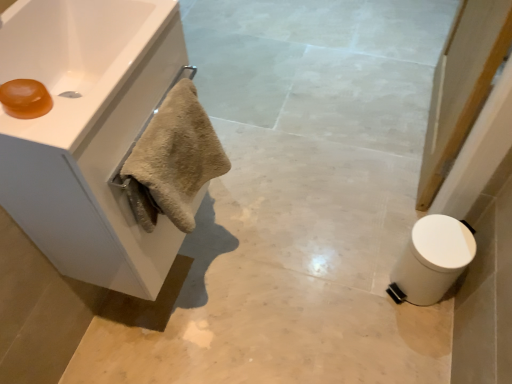
Question: Is white matte cabinet at upper left to the right of white matte trash can at lower right from the viewer's perspective?

Choices:
 (A) no
 (B) yes

Answer: (A)

Question: Is white matte cabinet at upper left directly adjacent to white matte trash can at lower right?

Choices:
 (A) yes
 (B) no

Answer: (B)

Question: Is white matte cabinet at upper left closer to camera compared to white matte trash can at lower right?

Choices:
 (A) yes
 (B) no

Answer: (A)

Question: Would you say white matte cabinet at upper left is a long distance from white matte trash can at lower right?

Choices:
 (A) yes
 (B) no

Answer: (B)

Question: Is white matte cabinet at upper left not inside white matte trash can at lower right?

Choices:
 (A) yes
 (B) no

Answer: (A)

Question: From the image's perspective, would you say white matte cabinet at upper left is positioned over white matte trash can at lower right?

Choices:
 (A) no
 (B) yes

Answer: (B)

Question: Can you confirm if white glossy sink at upper left is taller than white matte trash can at lower right?

Choices:
 (A) no
 (B) yes

Answer: (A)

Question: From a real-world perspective, is white glossy sink at upper left beneath white matte trash can at lower right?

Choices:
 (A) no
 (B) yes

Answer: (A)

Question: Is white glossy sink at upper left positioned far away from white matte trash can at lower right?

Choices:
 (A) yes
 (B) no

Answer: (B)

Question: Is white glossy sink at upper left bigger than white matte trash can at lower right?

Choices:
 (A) yes
 (B) no

Answer: (A)

Question: Can you confirm if white glossy sink at upper left is wider than white matte trash can at lower right?

Choices:
 (A) yes
 (B) no

Answer: (A)

Question: From the image's perspective, is white glossy sink at upper left below white matte trash can at lower right?

Choices:
 (A) yes
 (B) no

Answer: (B)

Question: Does white glossy sink at upper left contain white marble towel at left?

Choices:
 (A) yes
 (B) no

Answer: (B)